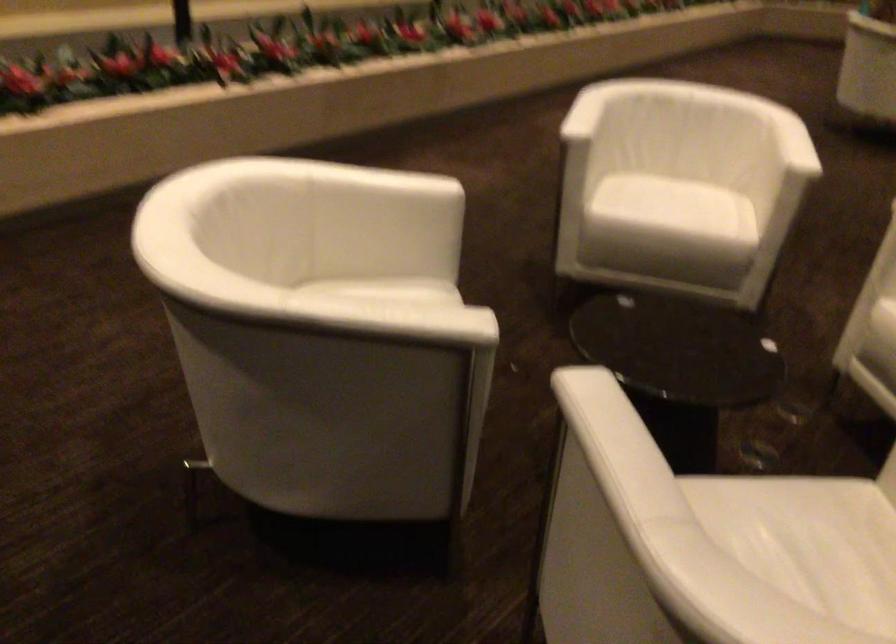
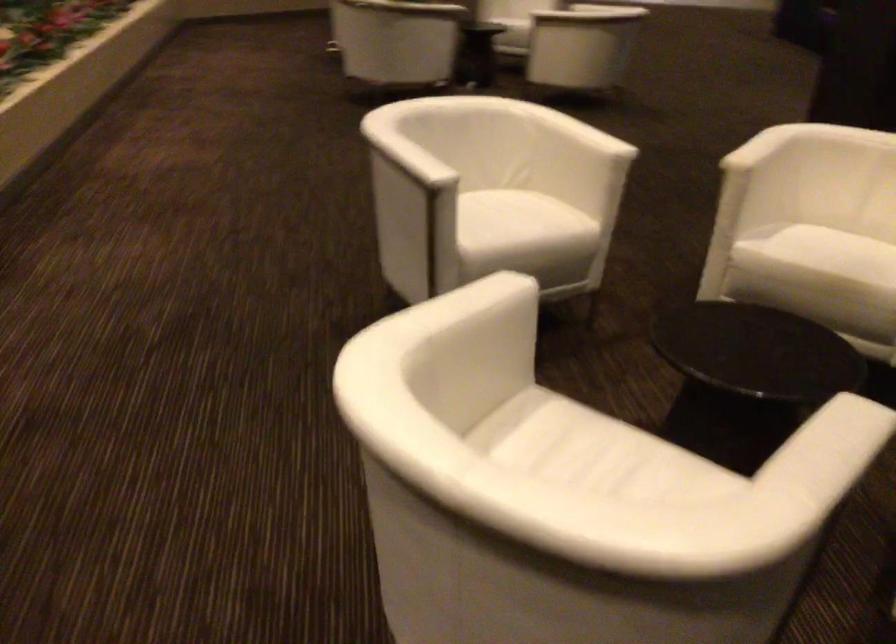
The point at (378, 310) is marked in the first image. Where is the corresponding point in the second image?

(839, 446)